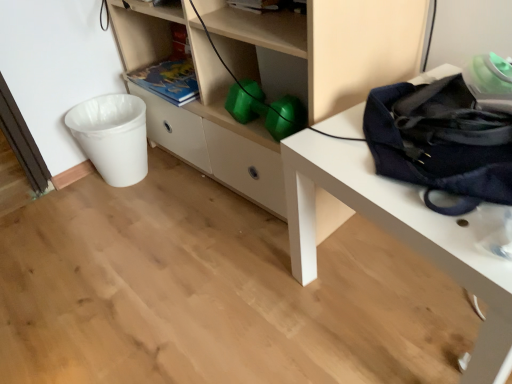
Question: From the image's perspective, is matte green book at center under navy blue fabric bag at right?

Choices:
 (A) yes
 (B) no

Answer: (B)

Question: Does matte green book at center appear on the right side of navy blue fabric bag at right?

Choices:
 (A) no
 (B) yes

Answer: (A)

Question: From a real-world perspective, is matte green book at center positioned over navy blue fabric bag at right based on gravity?

Choices:
 (A) no
 (B) yes

Answer: (B)

Question: Are matte green book at center and navy blue fabric bag at right far apart?

Choices:
 (A) no
 (B) yes

Answer: (A)

Question: From a real-world perspective, is matte green book at center positioned under navy blue fabric bag at right based on gravity?

Choices:
 (A) yes
 (B) no

Answer: (B)

Question: Can you confirm if matte green book at center is wider than navy blue fabric bag at right?

Choices:
 (A) no
 (B) yes

Answer: (A)

Question: Considering the relative sizes of white plastic trash can at left and matte white shelf at center in the image provided, is white plastic trash can at left bigger than matte white shelf at center?

Choices:
 (A) yes
 (B) no

Answer: (B)

Question: From a real-world perspective, is white plastic trash can at left beneath matte white shelf at center?

Choices:
 (A) no
 (B) yes

Answer: (B)

Question: From the image's perspective, is white plastic trash can at left beneath matte white shelf at center?

Choices:
 (A) no
 (B) yes

Answer: (B)

Question: Is matte white shelf at center at the back of white plastic trash can at left?

Choices:
 (A) yes
 (B) no

Answer: (B)

Question: Considering the relative positions of white plastic trash can at left and matte white shelf at center in the image provided, is white plastic trash can at left in front of matte white shelf at center?

Choices:
 (A) no
 (B) yes

Answer: (A)

Question: Considering the relative positions of white plastic trash can at left and matte white shelf at center in the image provided, is white plastic trash can at left to the left of matte white shelf at center from the viewer's perspective?

Choices:
 (A) no
 (B) yes

Answer: (B)

Question: From the image's perspective, is matte white shelf at center below white plastic trash can at left?

Choices:
 (A) no
 (B) yes

Answer: (A)